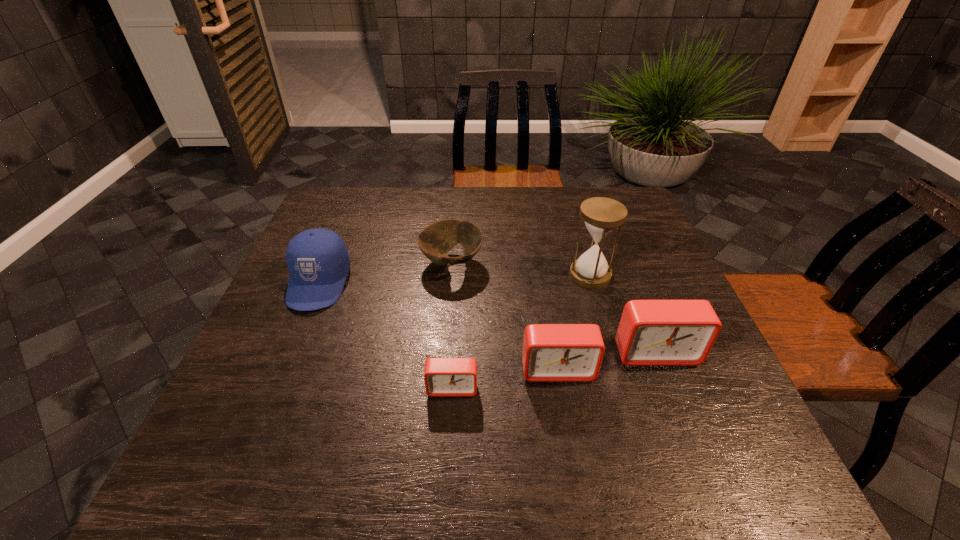
Locate an element on the screen. This screenshot has height=540, width=960. the shortest alarm clock is located at coordinates (443, 376).

This screenshot has width=960, height=540. What are the coordinates of `the second alarm clock from right to left` in the screenshot? It's located at (551, 352).

Locate an element on the screen. The height and width of the screenshot is (540, 960). the rightmost alarm clock is located at coordinates (651, 332).

Locate an element on the screen. bowl is located at coordinates (436, 240).

Where is `the leftmost object`? the leftmost object is located at coordinates (318, 261).

This screenshot has width=960, height=540. Identify the location of the tallest object. (601, 215).

Where is `vacant space located on the front-facing side of the second shortest alarm clock`? vacant space located on the front-facing side of the second shortest alarm clock is located at coordinates tap(568, 434).

At what (x,y) coordinates should I click in order to perform the action: click on free spot located on the front-facing side of the rightmost alarm clock. Please return your answer as a coordinate pair (x, y). Looking at the image, I should click on pos(671,393).

Find the location of a particular element. The width and height of the screenshot is (960, 540). vacant space situated 0.210m on the left of the bowl is located at coordinates (343, 263).

You are a GUI agent. You are given a task and a screenshot of the screen. Output one action in this format:
    pyautogui.click(x=<x>, y=<y>)
    Task: Click on the free space located on the front-facing side of the cap
    The image size is (960, 540).
    Given the screenshot: What is the action you would take?
    pyautogui.click(x=286, y=361)